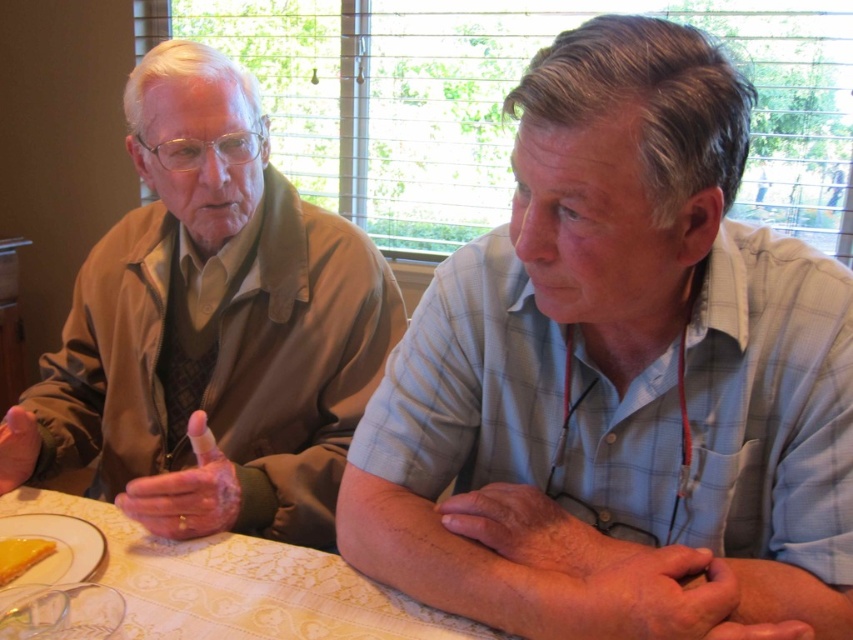
Consider the image. Is white lace tablecloth at center below yellow creamy cake at lower left?

Yes.

Is point (291, 616) positioned behind point (20, 556)?

No, (291, 616) is in front of (20, 556).

Which is behind, point (322, 604) or point (6, 563)?

Positioned behind is point (6, 563).

Image resolution: width=853 pixels, height=640 pixels. Identify the location of white lace tablecloth at center. (241, 586).

Consider the image. Can you confirm if matte brown jacket at left is taller than yellow creamy cake at lower left?

Yes.

Is point (93, 280) positioned behind point (24, 552)?

That is True.

Locate an element on the screen. The width and height of the screenshot is (853, 640). matte brown jacket at left is located at coordinates (212, 326).

Does light blue plaid shirt at center have a smaller size compared to matte brown jacket at left?

Correct, light blue plaid shirt at center occupies less space than matte brown jacket at left.

Between light blue plaid shirt at center and matte brown jacket at left, which one appears on the right side from the viewer's perspective?

light blue plaid shirt at center

Find the location of a particular element. light blue plaid shirt at center is located at coordinates (619, 378).